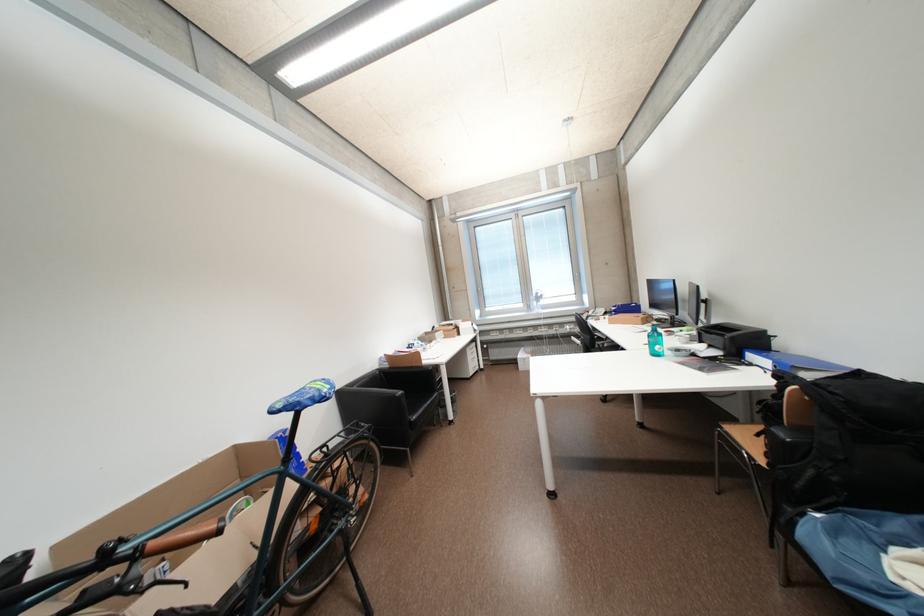
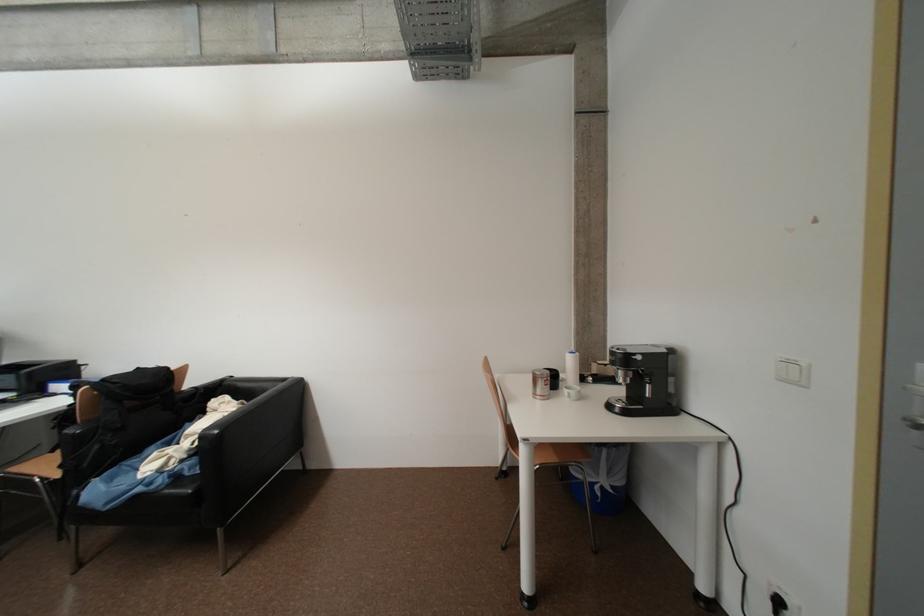
Locate, in the second image, the point that corresponds to point 820,474 in the first image.

(104, 448)